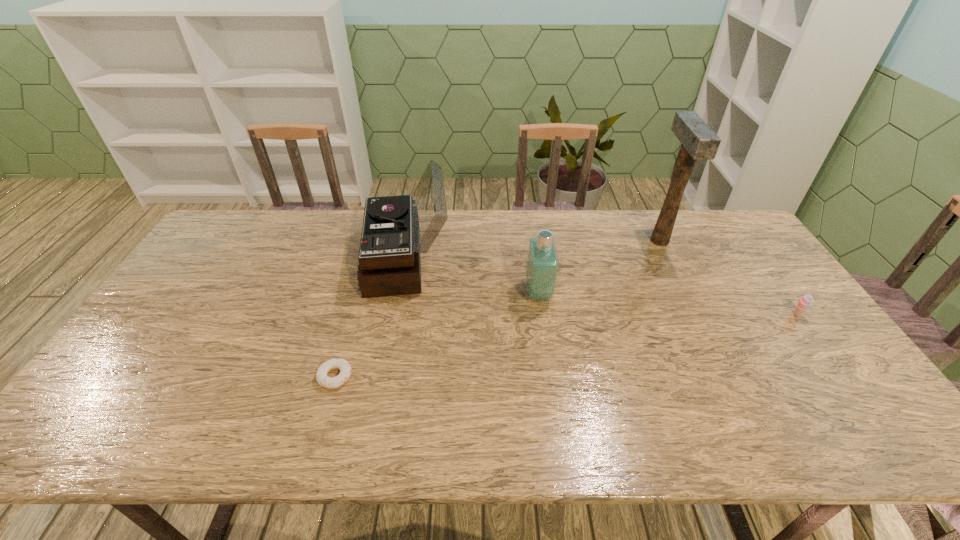
Locate an element on the screen. vacant area situated on the front of the record player is located at coordinates (380, 395).

You are a GUI agent. You are given a task and a screenshot of the screen. Output one action in this format:
    pyautogui.click(x=<x>, y=<y>)
    Task: Click on the vacant space situated 0.190m on the front label of the perfume
    The image size is (960, 540).
    Given the screenshot: What is the action you would take?
    pyautogui.click(x=462, y=293)

Find the location of a particular element. free space located on the front label of the perfume is located at coordinates (419, 293).

You are a GUI agent. You are given a task and a screenshot of the screen. Output one action in this format:
    pyautogui.click(x=<x>, y=<y>)
    Task: Click on the free point located 0.190m on the front label of the perfume
    The image size is (960, 540).
    Given the screenshot: What is the action you would take?
    pyautogui.click(x=462, y=293)

Locate an element on the screen. The image size is (960, 540). vacant region located on the back of the second nearest object is located at coordinates (735, 231).

This screenshot has height=540, width=960. Find the location of `vacant area situated on the right of the shortest object`. vacant area situated on the right of the shortest object is located at coordinates (448, 376).

Locate an element on the screen. Image resolution: width=960 pixels, height=540 pixels. mallet located in the far edge section of the desktop is located at coordinates (699, 142).

This screenshot has width=960, height=540. Identify the location of record player that is at the far edge. (396, 229).

This screenshot has width=960, height=540. In order to click on object at the right edge in this screenshot , I will do `click(805, 302)`.

What are the coordinates of `vacant space at the far edge of the desktop` in the screenshot? It's located at (492, 234).